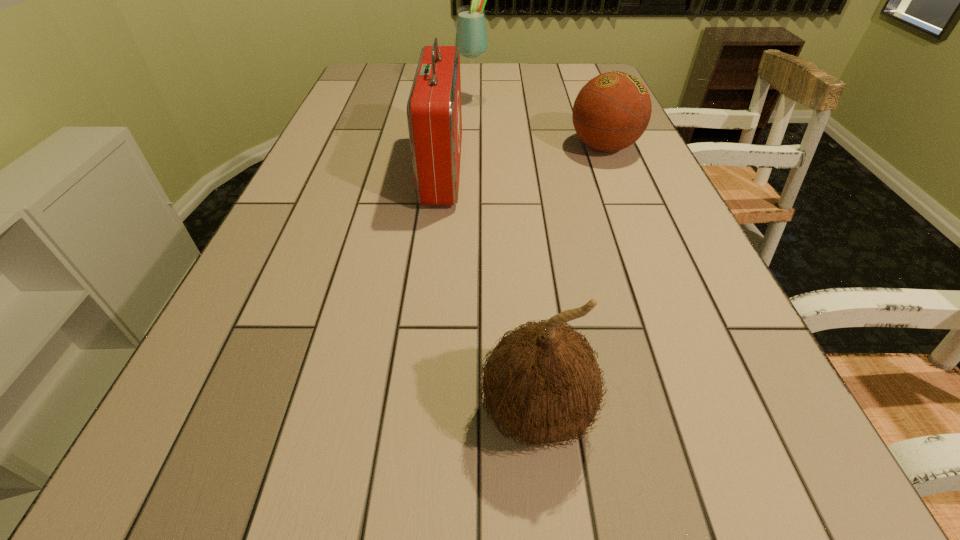
This screenshot has width=960, height=540. What are the coordinates of `vacant space at the far edge` in the screenshot? It's located at (517, 75).

Locate an element on the screen. The width and height of the screenshot is (960, 540). blank space at the left edge is located at coordinates (364, 104).

The width and height of the screenshot is (960, 540). In the image, there is a desktop. In order to click on free space at the right edge in this screenshot , I will do point(749,355).

Identify the location of free spot at the far right corner of the desktop. This screenshot has height=540, width=960. (591, 70).

Identify the location of vacant area between the alcohol and the basketball. The image size is (960, 540). (539, 124).

You are a GUI agent. You are given a task and a screenshot of the screen. Output one action in this format:
    pyautogui.click(x=<x>, y=<y>)
    Task: Click on the free space between the first-aid kit and the coconut
    
    Given the screenshot: What is the action you would take?
    pyautogui.click(x=490, y=292)

Where is `unoccupied area between the first-aid kit and the third tallest object`? unoccupied area between the first-aid kit and the third tallest object is located at coordinates (490, 292).

You are a GUI agent. You are given a task and a screenshot of the screen. Output one action in this format:
    pyautogui.click(x=<x>, y=<y>)
    Task: Click on the vacant area that lies between the shortest object and the second shortest object
    This screenshot has width=960, height=540.
    Given the screenshot: What is the action you would take?
    pyautogui.click(x=570, y=280)

Identify the location of vacant space that is in between the basketball and the first-aid kit. The height and width of the screenshot is (540, 960). (523, 159).

You are a GUI agent. You are given a task and a screenshot of the screen. Output one action in this format:
    pyautogui.click(x=<x>, y=<y>)
    Task: Click on the free spot between the coconut and the basketball
    The width and height of the screenshot is (960, 540).
    Given the screenshot: What is the action you would take?
    (x=570, y=280)